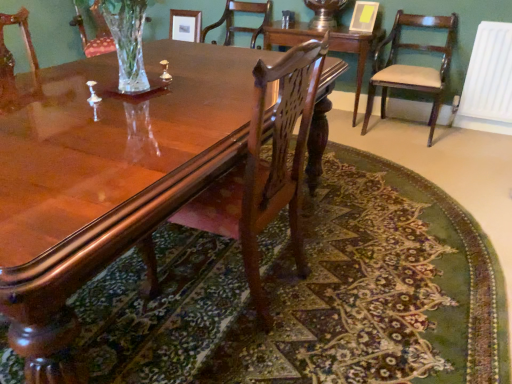
This screenshot has width=512, height=384. I want to click on vacant region to the left of white plastic radiator at right, so click(444, 133).